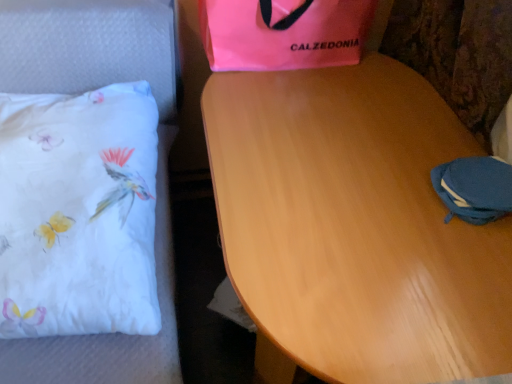
This screenshot has height=384, width=512. I want to click on vacant space that is to the left of blue fabric pouch at lower right, so click(x=388, y=188).